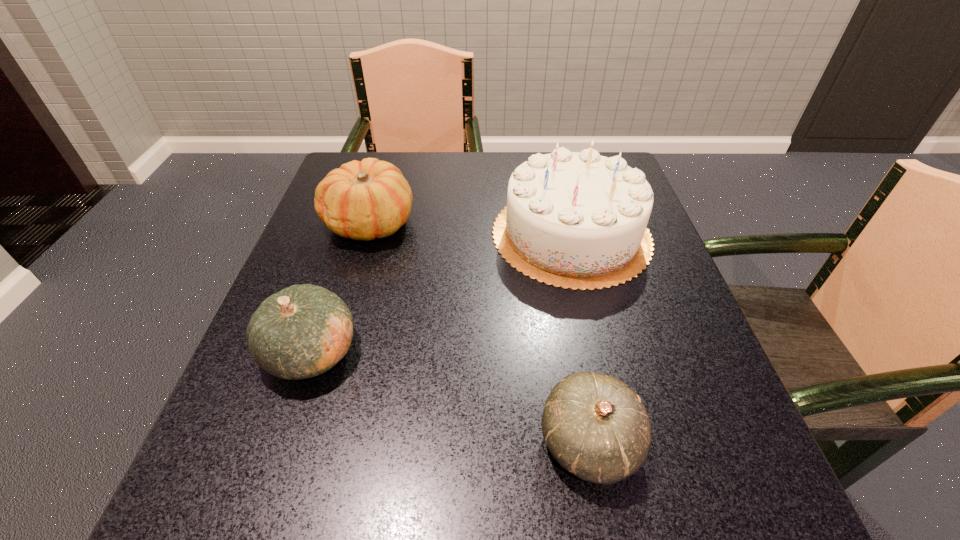
Locate an element on the screen. The image size is (960, 540). vacant space at the far left corner of the desktop is located at coordinates (392, 159).

The image size is (960, 540). I want to click on blank space at the near left corner, so click(270, 493).

The image size is (960, 540). Identify the location of free space between the tallest object and the second nearest object. (442, 293).

Where is `vacant area between the birthday cake and the second farthest gourd`? This screenshot has height=540, width=960. vacant area between the birthday cake and the second farthest gourd is located at coordinates (442, 293).

Identify the location of free space between the third farthest object and the farthest gourd. (341, 287).

The height and width of the screenshot is (540, 960). I want to click on vacant space that's between the farthest gourd and the second nearest gourd, so click(341, 287).

What are the coordinates of `empty location between the farthest gourd and the shortest object` in the screenshot? It's located at tap(480, 333).

You are a GUI agent. You are given a task and a screenshot of the screen. Output one action in this format:
    pyautogui.click(x=<x>, y=<y>)
    Task: Click on the free space that is in between the farthest gourd and the shortest object
    This screenshot has height=540, width=960.
    Given the screenshot: What is the action you would take?
    pyautogui.click(x=480, y=333)

I want to click on unoccupied position between the rightmost gourd and the second nearest gourd, so click(450, 397).

At what (x,y) coordinates should I click in order to perform the action: click on free space that is in between the shortest gourd and the tallest object. Please return your answer as a coordinate pair (x, y). Looking at the image, I should click on (581, 338).